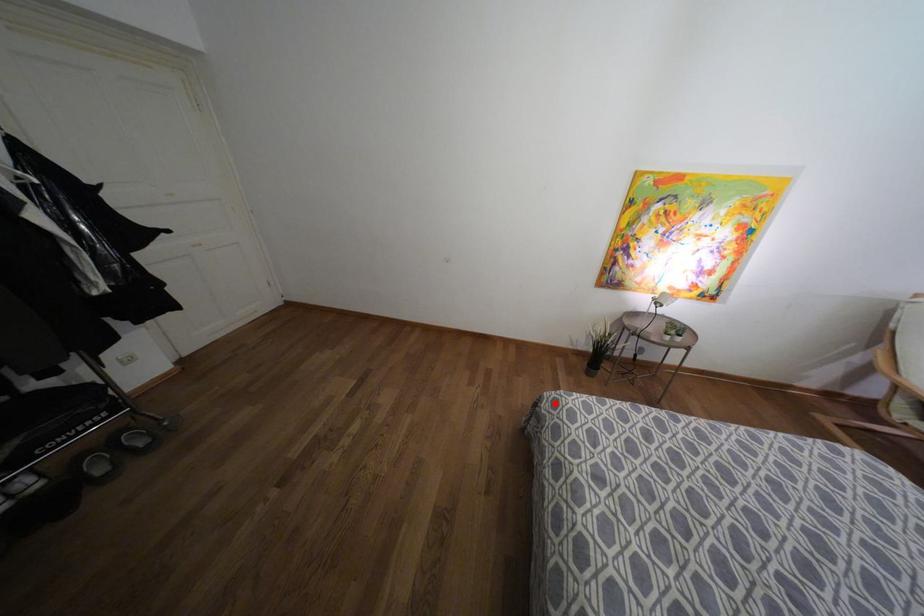
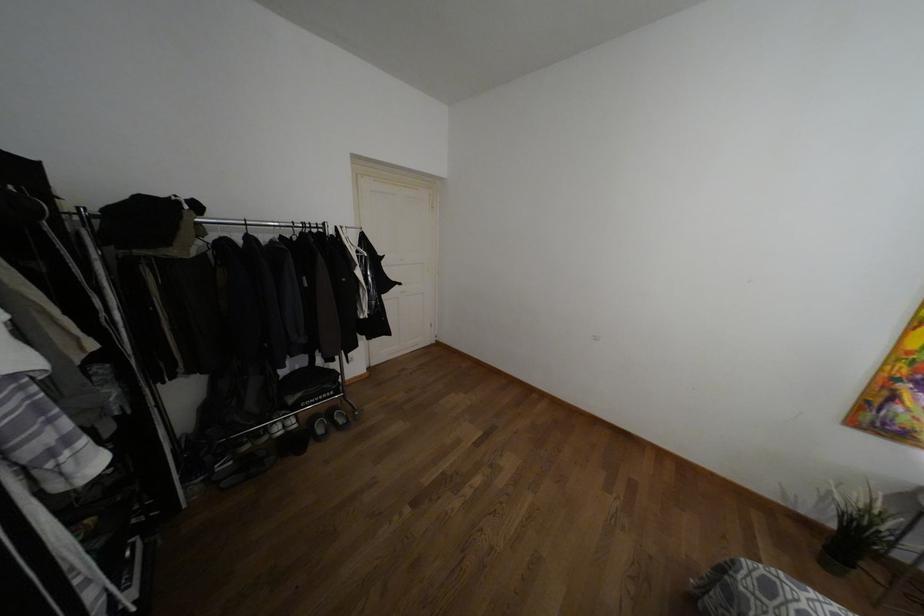
Where in the second image is the point corresponding to the highlighted location from the first image?

(769, 588)